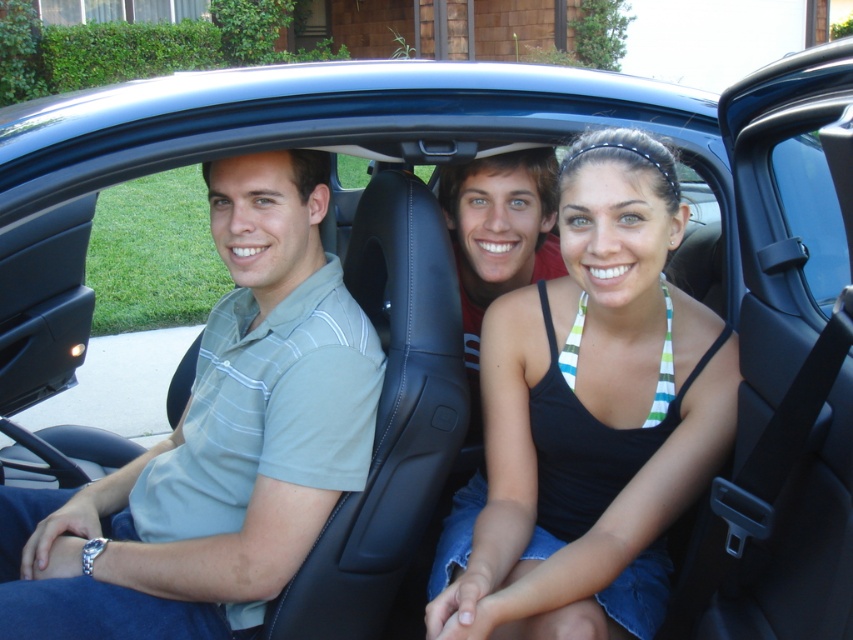
You are sitting in the back seat of the car and want to reach for an object located at point A and another at point B. Point A is at coordinates point (621, 298) and point B is at point (97, 493). Which point is closer to you?

Point A at coordinates point (621, 298) is closer to you than point B at point (97, 493).

You are standing 6 feet away from the car. Can you reach the point at coordinates point (503,342) without moving closer?

The point at coordinates point (503,342) is 5.73 feet away from the viewer. Since you are standing 6 feet away, you can reach it without moving closer.